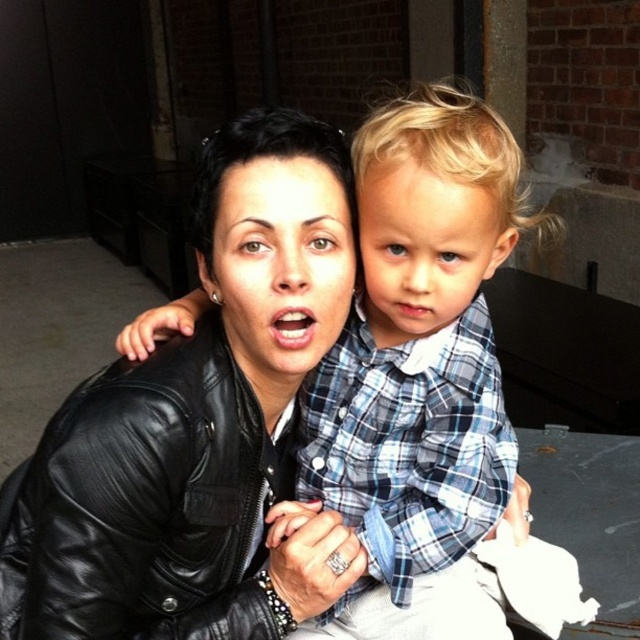
Between point (428, 548) and point (115, 554), which one is positioned behind?

Point (428, 548)

Is blue plaid shirt at center positioned behind black leather jacket at center?

No.

Who is more forward, [362,516] or [193,556]?

Point [193,556] is in front.

You are a GUI agent. You are given a task and a screenshot of the screen. Output one action in this format:
    pyautogui.click(x=<x>, y=<y>)
    Task: Click on the blue plaid shirt at center
    The width and height of the screenshot is (640, 640).
    Given the screenshot: What is the action you would take?
    [419, 376]